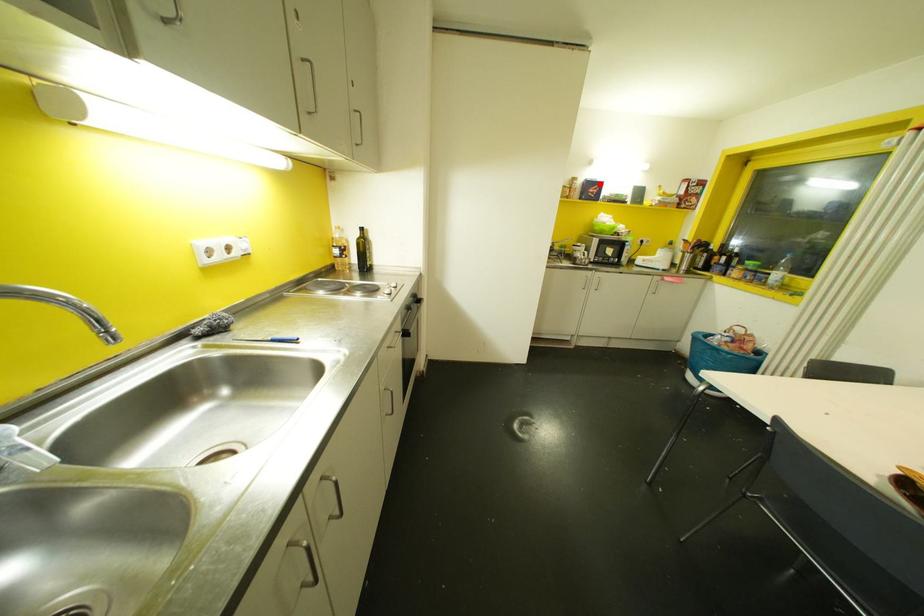
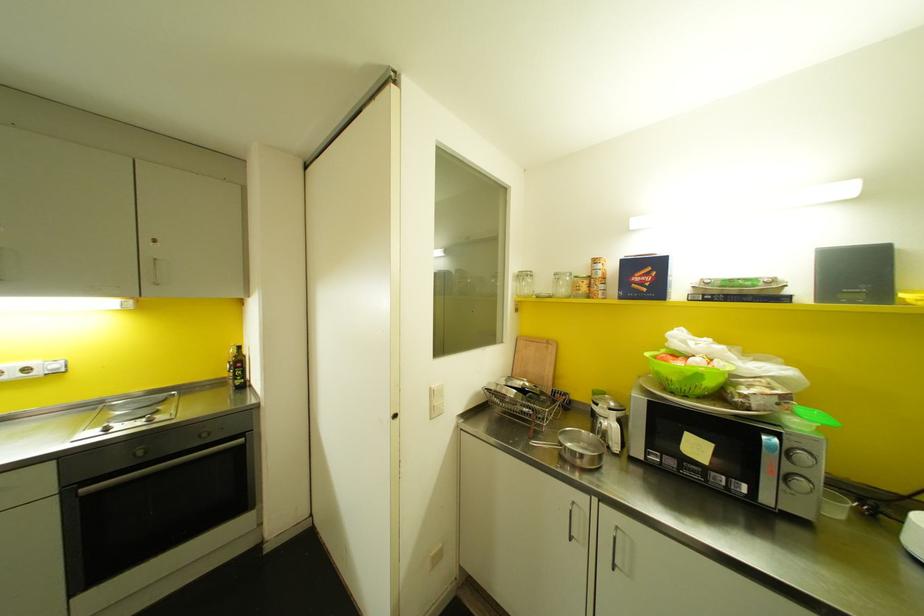
Where in the second image is the point corresponding to the highlighted location from the first image?

(659, 264)